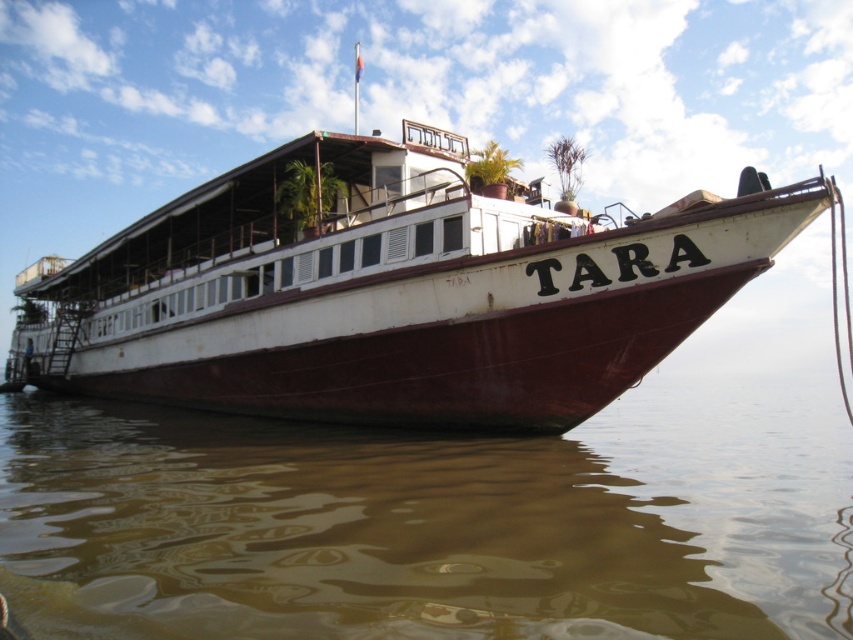
You are standing on the deck of the TARA riverboat and notice two points marked on the image. The first point is at coordinates point (846, 436), and the second is at point (322, 140). From your current position, which point is farther away from you?

Point (846, 436) is behind point (322, 140), so it is farther away from your current position.

You are standing on the deck of the TARA riverboat and notice a specific location marked by coordinates. Based on the scene description, can you identify what object or feature is located at the coordinates point (438, 520)?

The coordinates point (438, 520) correspond to the brown matte water at lower center.